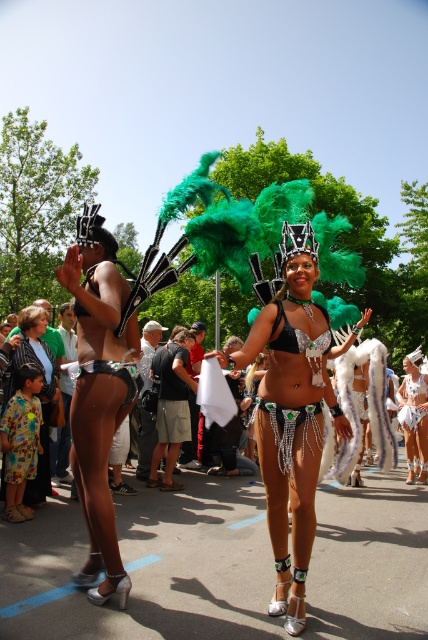
Between shiny silver bikini top at center and black sequined bikini top at center, which one has more height?

shiny silver bikini top at center is taller.

Does point (323, 376) come closer to viewer compared to point (278, 323)?

No, (323, 376) is behind (278, 323).

Describe the element at coordinates (291, 412) in the screenshot. Image resolution: width=428 pixels, height=640 pixels. I see `shiny silver bikini top at center` at that location.

Locate an element on the screen. This screenshot has width=428, height=640. shiny silver bikini top at center is located at coordinates (291, 412).

Based on the photo, who is lower down, black sequined bikini top at center or white lace skirt at center?

white lace skirt at center is lower down.

Is black sequined bikini top at center wider than white lace skirt at center?

No, black sequined bikini top at center is not wider than white lace skirt at center.

Is point (329, 337) positioned before point (412, 392)?

Yes.

The image size is (428, 640). What are the coordinates of `black sequined bikini top at center` in the screenshot? It's located at (297, 333).

Can you confirm if white sequined bikini at center is smaller than white lace skirt at center?

No, white sequined bikini at center is not smaller than white lace skirt at center.

From the picture: Does white sequined bikini at center have a lesser width compared to white lace skirt at center?

Incorrect, white sequined bikini at center's width is not less than white lace skirt at center's.

Between point (401, 388) and point (418, 410), which one is positioned in front?

Positioned in front is point (418, 410).

Identify the location of white sequined bikini at center. The width and height of the screenshot is (428, 640). (413, 413).